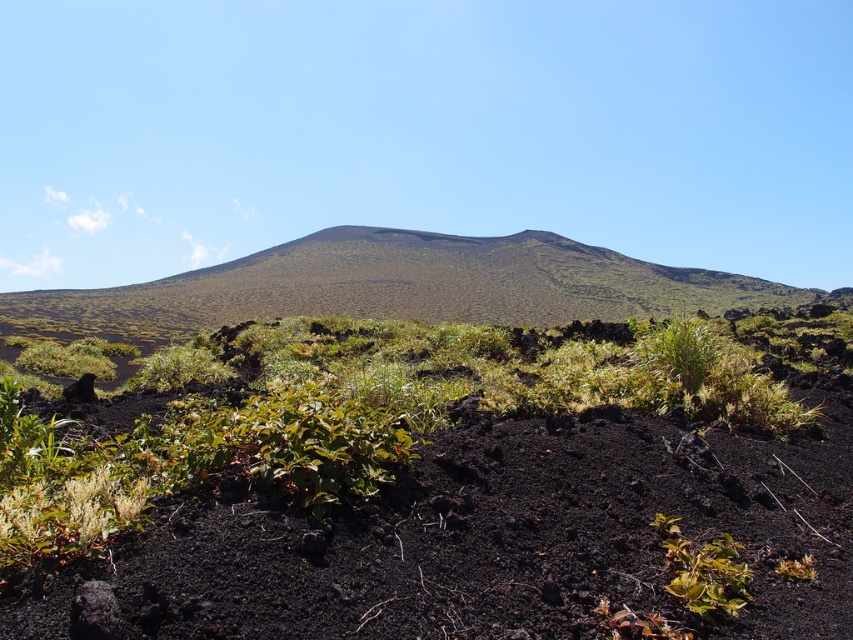
Question: From the image, what is the correct spatial relationship of green shrubs at center in relation to green grassy hillside at center?

Choices:
 (A) right
 (B) left

Answer: (A)

Question: Does green shrubs at center have a greater width compared to green grassy hillside at center?

Choices:
 (A) yes
 (B) no

Answer: (B)

Question: Does green shrubs at center appear on the left side of green grassy hillside at center?

Choices:
 (A) no
 (B) yes

Answer: (A)